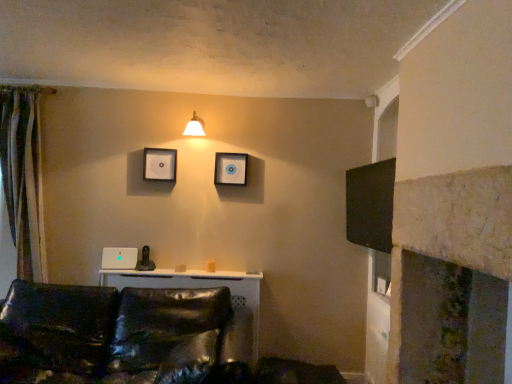
The width and height of the screenshot is (512, 384). What do you see at coordinates (230, 169) in the screenshot? I see `white glossy picture frame at upper center, the first picture frame from the right` at bounding box center [230, 169].

The height and width of the screenshot is (384, 512). I want to click on silky beige curtain at left, so click(x=23, y=178).

This screenshot has height=384, width=512. Describe the element at coordinates (136, 338) in the screenshot. I see `shiny black leather couch at lower left` at that location.

This screenshot has width=512, height=384. In order to click on shiny black leather couch at lower left in this screenshot , I will do pos(136,338).

What is the approximate width of white matte picture frame at upper center, the first picture frame from the left?

It is 2.13 inches.

From the picture: What is the approximate height of white glossy wall sconce at upper center?

It is 21.36 centimeters.

Where is `white glossy picture frame at upper center, the first picture frame from the right`? Image resolution: width=512 pixels, height=384 pixels. white glossy picture frame at upper center, the first picture frame from the right is located at coordinates (230, 169).

What's the angular difference between silky beige curtain at left and white glossy picture frame at upper center, arranged as the second picture frame when viewed from the left,'s facing directions?

0.00272 degrees separate the facing orientations of silky beige curtain at left and white glossy picture frame at upper center, arranged as the second picture frame when viewed from the left.

Considering the relative sizes of silky beige curtain at left and white glossy picture frame at upper center, the first picture frame from the right, in the image provided, is silky beige curtain at left thinner than white glossy picture frame at upper center, the first picture frame from the right,?

No.

Is silky beige curtain at left outside of white glossy picture frame at upper center, arranged as the second picture frame when viewed from the left?

silky beige curtain at left is positioned outside white glossy picture frame at upper center, arranged as the second picture frame when viewed from the left.

Considering the relative sizes of silky beige curtain at left and white glossy picture frame at upper center, arranged as the second picture frame when viewed from the left, in the image provided, is silky beige curtain at left smaller than white glossy picture frame at upper center, arranged as the second picture frame when viewed from the left,?

No, silky beige curtain at left is not smaller than white glossy picture frame at upper center, arranged as the second picture frame when viewed from the left.

Is the depth of shiny black leather couch at lower left greater than that of white glossy wall sconce at upper center?

No, it is in front of white glossy wall sconce at upper center.

From the image's perspective, is shiny black leather couch at lower left beneath white glossy wall sconce at upper center?

Yes, from the image's perspective, shiny black leather couch at lower left is below white glossy wall sconce at upper center.

From a real-world perspective, is shiny black leather couch at lower left located higher than white glossy wall sconce at upper center?

Incorrect, from a real-world perspective, shiny black leather couch at lower left is lower than white glossy wall sconce at upper center.

Is shiny black leather couch at lower left smaller than white glossy wall sconce at upper center?

No.

In the scene shown: From a real-world perspective, is shiny black leather couch at lower left physically located above or below silky beige curtain at left?

From a real-world perspective, shiny black leather couch at lower left is physically below silky beige curtain at left.

Is point (205, 340) positioned before point (5, 128)?

Yes, it is.

How many degrees apart are the facing directions of shiny black leather couch at lower left and silky beige curtain at left?

They differ by 0.586 degrees in their facing directions.

Could you tell me if shiny black leather couch at lower left is turned towards silky beige curtain at left?

No, shiny black leather couch at lower left is not facing towards silky beige curtain at left.

Considering the relative sizes of white matte picture frame at upper center, arranged as the second picture frame when viewed from the right, and silky beige curtain at left in the image provided, is white matte picture frame at upper center, arranged as the second picture frame when viewed from the right, wider than silky beige curtain at left?

No.

Which is behind, white matte picture frame at upper center, arranged as the second picture frame when viewed from the right, or silky beige curtain at left?

Positioned behind is white matte picture frame at upper center, arranged as the second picture frame when viewed from the right.

Is white matte picture frame at upper center, arranged as the second picture frame when viewed from the right, turned away from silky beige curtain at left?

white matte picture frame at upper center, arranged as the second picture frame when viewed from the right, does not have its back to silky beige curtain at left.

Which is in front, point (245, 155) or point (152, 168)?

Positioned in front is point (152, 168).

Is white glossy picture frame at upper center, arranged as the second picture frame when viewed from the left, turned away from white matte picture frame at upper center, arranged as the second picture frame when viewed from the right?

No, white glossy picture frame at upper center, arranged as the second picture frame when viewed from the left, is not facing the opposite direction of white matte picture frame at upper center, arranged as the second picture frame when viewed from the right.

Does white glossy picture frame at upper center, the first picture frame from the right, have a smaller size compared to white matte picture frame at upper center, arranged as the second picture frame when viewed from the right?

Actually, white glossy picture frame at upper center, the first picture frame from the right, might be larger than white matte picture frame at upper center, arranged as the second picture frame when viewed from the right.

Does silky beige curtain at left lie in front of white glossy wall sconce at upper center?

Yes, it is in front of white glossy wall sconce at upper center.

How much distance is there between silky beige curtain at left and white glossy wall sconce at upper center?

silky beige curtain at left and white glossy wall sconce at upper center are 1.27 meters apart.

Would you say silky beige curtain at left is a long distance from white glossy wall sconce at upper center?

Yes, silky beige curtain at left and white glossy wall sconce at upper center are located far from each other.

Can you confirm if silky beige curtain at left is shorter than white glossy wall sconce at upper center?

No.

Is white glossy wall sconce at upper center turned away from silky beige curtain at left?

No, white glossy wall sconce at upper center is not facing away from silky beige curtain at left.

Considering the relative sizes of white glossy wall sconce at upper center and silky beige curtain at left in the image provided, is white glossy wall sconce at upper center shorter than silky beige curtain at left?

Indeed, white glossy wall sconce at upper center has a lesser height compared to silky beige curtain at left.

Is the depth of white glossy wall sconce at upper center less than that of silky beige curtain at left?

No, it is not.

From the image's perspective, is white glossy wall sconce at upper center above silky beige curtain at left?

Yes, from the image's perspective, white glossy wall sconce at upper center is on top of silky beige curtain at left.

This screenshot has height=384, width=512. I want to click on curtain below the white glossy picture frame at upper center, arranged as the second picture frame when viewed from the left (from the image's perspective), so pos(23,178).

In order to click on light fixture on the right of the shiny black leather couch at lower left in this screenshot , I will do `click(195, 126)`.

Considering their positions, is white matte picture frame at upper center, arranged as the second picture frame when viewed from the right, positioned closer to silky beige curtain at left than shiny black leather couch at lower left?

Among the two, white matte picture frame at upper center, arranged as the second picture frame when viewed from the right, is located nearer to silky beige curtain at left.

From the image, which object appears to be nearer to white glossy picture frame at upper center, arranged as the second picture frame when viewed from the left, white glossy wall sconce at upper center or shiny black leather couch at lower left?

white glossy wall sconce at upper center.

Which object lies nearer to the anchor point white matte picture frame at upper center, the first picture frame from the left, white glossy wall sconce at upper center or silky beige curtain at left?

white glossy wall sconce at upper center.

Based on their spatial positions, is white matte picture frame at upper center, the first picture frame from the left, or white glossy picture frame at upper center, arranged as the second picture frame when viewed from the left, further from shiny black leather couch at lower left?

white glossy picture frame at upper center, arranged as the second picture frame when viewed from the left, is further to shiny black leather couch at lower left.

Based on their spatial positions, is white glossy picture frame at upper center, the first picture frame from the right, or white matte picture frame at upper center, arranged as the second picture frame when viewed from the right, further from shiny black leather couch at lower left?

white glossy picture frame at upper center, the first picture frame from the right, lies further to shiny black leather couch at lower left than the other object.

Based on their spatial positions, is white matte picture frame at upper center, the first picture frame from the left, or silky beige curtain at left closer to white glossy picture frame at upper center, arranged as the second picture frame when viewed from the left?

white matte picture frame at upper center, the first picture frame from the left.

When comparing their distances from white matte picture frame at upper center, the first picture frame from the left, does silky beige curtain at left or white glossy wall sconce at upper center seem closer?

white glossy wall sconce at upper center is positioned closer to the anchor white matte picture frame at upper center, the first picture frame from the left.

When comparing their distances from silky beige curtain at left, does white glossy wall sconce at upper center or shiny black leather couch at lower left seem closer?

The object closer to silky beige curtain at left is shiny black leather couch at lower left.

At what (x,y) coordinates should I click in order to perform the action: click on furniture between silky beige curtain at left and white glossy picture frame at upper center, arranged as the second picture frame when viewed from the left. Please return your answer as a coordinate pair (x, y). This screenshot has height=384, width=512. Looking at the image, I should click on (136, 338).

What are the coordinates of `light fixture between silky beige curtain at left and white glossy picture frame at upper center, arranged as the second picture frame when viewed from the left, from left to right` in the screenshot? It's located at (195, 126).

The height and width of the screenshot is (384, 512). Identify the location of picture frame between silky beige curtain at left and white glossy picture frame at upper center, arranged as the second picture frame when viewed from the left. (160, 164).

Identify the location of picture frame positioned between shiny black leather couch at lower left and white matte picture frame at upper center, the first picture frame from the left, from near to far. This screenshot has height=384, width=512. (230, 169).